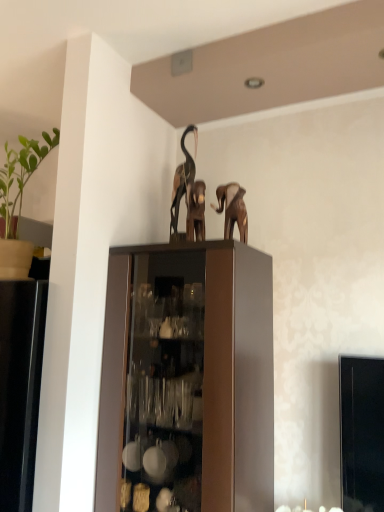
Question: From the image's perspective, is brown matte elephant at upper center under wooden elephant at center, the second animal from the back?

Choices:
 (A) no
 (B) yes

Answer: (B)

Question: Would you say brown matte elephant at upper center is outside wooden elephant at center, which is the first animal in front-to-back order?

Choices:
 (A) yes
 (B) no

Answer: (A)

Question: Can you confirm if brown matte elephant at upper center is wider than wooden elephant at center, the second animal from the back?

Choices:
 (A) yes
 (B) no

Answer: (A)

Question: Is brown matte elephant at upper center thinner than wooden elephant at center, which is the first animal in front-to-back order?

Choices:
 (A) no
 (B) yes

Answer: (A)

Question: Does brown matte elephant at upper center have a larger size compared to wooden elephant at center, which is the first animal in front-to-back order?

Choices:
 (A) yes
 (B) no

Answer: (A)

Question: Is the position of brown matte elephant at upper center more distant than that of wooden elephant at center, the second animal from the back?

Choices:
 (A) no
 (B) yes

Answer: (B)

Question: Could you tell me if brown matte elephant at upper center is turned towards metallic brown elephant at upper center, which is the 1th animal in back-to-front order?

Choices:
 (A) no
 (B) yes

Answer: (A)

Question: Can you confirm if brown matte elephant at upper center is bigger than metallic brown elephant at upper center, marked as the second animal in a front-to-back arrangement?

Choices:
 (A) yes
 (B) no

Answer: (B)

Question: Is brown matte elephant at upper center oriented away from metallic brown elephant at upper center, marked as the second animal in a front-to-back arrangement?

Choices:
 (A) yes
 (B) no

Answer: (B)

Question: From the image's perspective, is brown matte elephant at upper center beneath metallic brown elephant at upper center, marked as the second animal in a front-to-back arrangement?

Choices:
 (A) yes
 (B) no

Answer: (A)

Question: From the image's perspective, would you say brown matte elephant at upper center is positioned over metallic brown elephant at upper center, marked as the second animal in a front-to-back arrangement?

Choices:
 (A) yes
 (B) no

Answer: (B)

Question: Is brown matte elephant at upper center to the left of metallic brown elephant at upper center, marked as the second animal in a front-to-back arrangement, from the viewer's perspective?

Choices:
 (A) no
 (B) yes

Answer: (A)

Question: Does green matte plant at left come behind brown matte elephant at upper center?

Choices:
 (A) yes
 (B) no

Answer: (B)